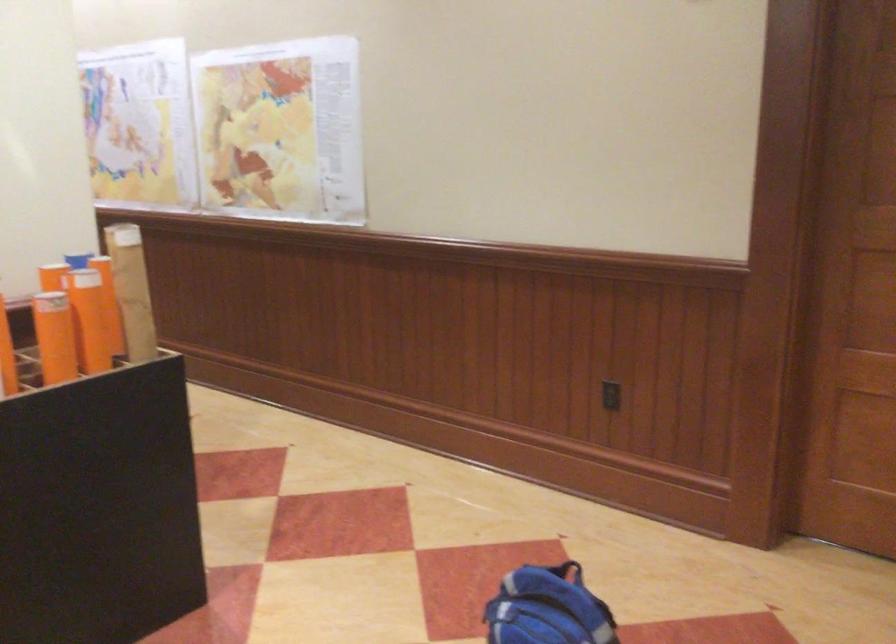
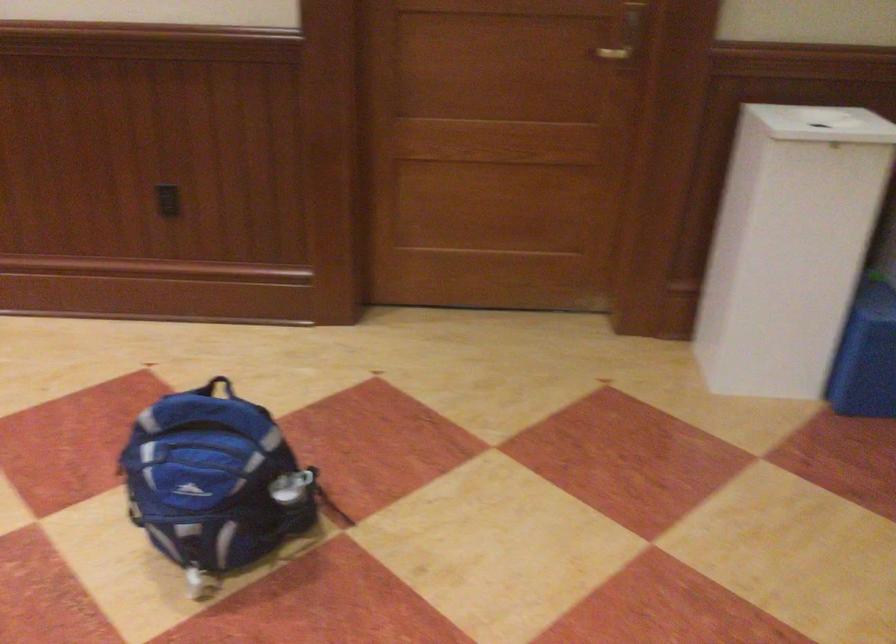
In the second image, find the point that corresponds to point (563, 576) in the first image.

(217, 386)